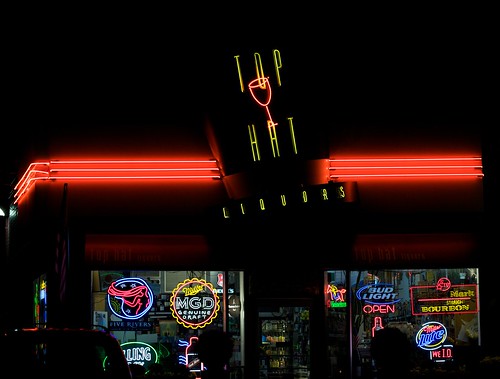
Find the location of a particular element. door is located at coordinates (318, 349).